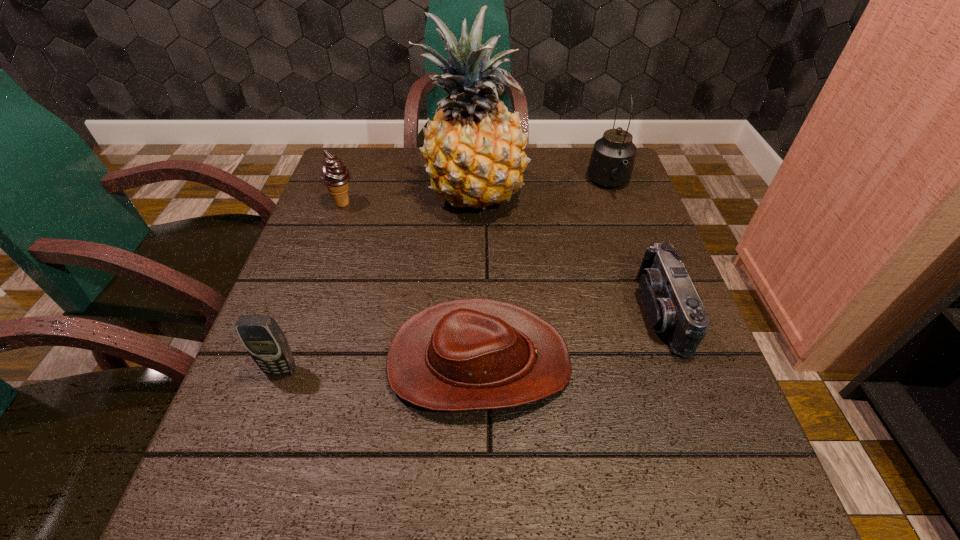
You are a GUI agent. You are given a task and a screenshot of the screen. Output one action in this format:
    pyautogui.click(x=<x>, y=<y>)
    Task: Click on the vacant point located between the cellular telephone and the fifth shortest object
    This screenshot has height=540, width=960.
    Given the screenshot: What is the action you would take?
    pyautogui.click(x=445, y=277)

Locate an element on the screen. This screenshot has width=960, height=540. free space between the shortest object and the icecream is located at coordinates (411, 282).

In order to click on vacant space that is in between the cowboy hat and the camcorder in this screenshot , I will do `click(570, 336)`.

The image size is (960, 540). Identify the location of unoccupied position between the pineapple and the kettle. (541, 190).

You are a GUI agent. You are given a task and a screenshot of the screen. Output one action in this format:
    pyautogui.click(x=<x>, y=<y>)
    Task: Click on the free space between the pineapple and the shortest object
    Image resolution: width=960 pixels, height=540 pixels.
    Given the screenshot: What is the action you would take?
    pyautogui.click(x=476, y=279)

You are a GUI agent. You are given a task and a screenshot of the screen. Output one action in this format:
    pyautogui.click(x=<x>, y=<y>)
    Task: Click on the unoccupied position between the pineapple and the shortest object
    This screenshot has height=540, width=960.
    Given the screenshot: What is the action you would take?
    pyautogui.click(x=476, y=279)

Where is `free space between the cellular telephone and the cowboy hat`? free space between the cellular telephone and the cowboy hat is located at coordinates (380, 366).

Image resolution: width=960 pixels, height=540 pixels. Find the location of `vacant area that lies between the cellular telephone and the cowboy hat`. vacant area that lies between the cellular telephone and the cowboy hat is located at coordinates (380, 366).

Locate an element on the screen. vacant area between the shortest object and the fifth tallest object is located at coordinates (570, 336).

Find the location of `object that is the fourth closest to the tallest object`. object that is the fourth closest to the tallest object is located at coordinates (469, 354).